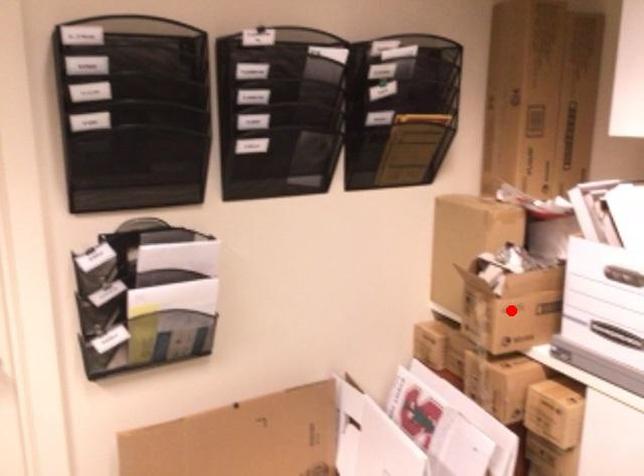
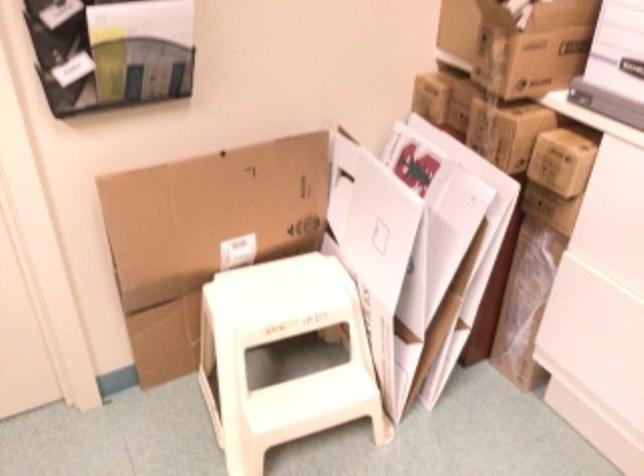
Question: I am providing you with two images of the same scene from different viewpoints. A red point is marked on the first image. Is the red point's position out of view in image 2?

Choices:
 (A) Yes
 (B) No

Answer: (B)